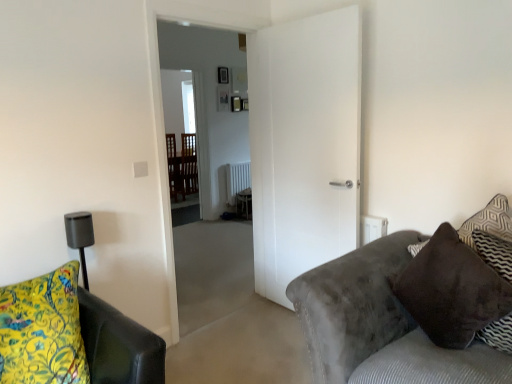
Question: Is yellow floral fabric cushion at lower left outside of white matte door at center?

Choices:
 (A) no
 (B) yes

Answer: (B)

Question: From the image's perspective, is yellow floral fabric cushion at lower left over white matte door at center?

Choices:
 (A) yes
 (B) no

Answer: (B)

Question: Would you consider yellow floral fabric cushion at lower left to be distant from white matte door at center?

Choices:
 (A) yes
 (B) no

Answer: (A)

Question: Can you confirm if yellow floral fabric cushion at lower left is smaller than white matte door at center?

Choices:
 (A) no
 (B) yes

Answer: (B)

Question: From the image's perspective, is yellow floral fabric cushion at lower left under white matte door at center?

Choices:
 (A) no
 (B) yes

Answer: (B)

Question: Considering the relative sizes of yellow floral fabric cushion at lower left and white matte door at center in the image provided, is yellow floral fabric cushion at lower left taller than white matte door at center?

Choices:
 (A) yes
 (B) no

Answer: (B)

Question: Is white painted radiator at center far from white matte door at center?

Choices:
 (A) yes
 (B) no

Answer: (A)

Question: Is white painted radiator at center to the right of white matte door at center from the viewer's perspective?

Choices:
 (A) yes
 (B) no

Answer: (B)

Question: Could you tell me if white painted radiator at center is turned towards white matte door at center?

Choices:
 (A) no
 (B) yes

Answer: (A)

Question: Is white painted radiator at center next to white matte door at center?

Choices:
 (A) yes
 (B) no

Answer: (B)

Question: From the image's perspective, is white painted radiator at center above white matte door at center?

Choices:
 (A) no
 (B) yes

Answer: (B)

Question: Would you say white painted radiator at center is outside white matte door at center?

Choices:
 (A) no
 (B) yes

Answer: (B)

Question: Is white matte door at center next to white painted radiator at center?

Choices:
 (A) no
 (B) yes

Answer: (A)